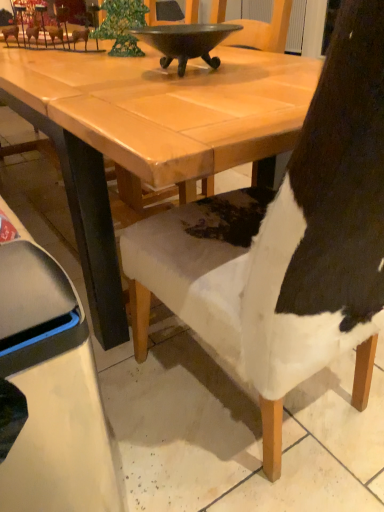
Identify the location of white fabric chair at lower right, acting as the 2th chair starting from the right. (52, 389).

Consider the image. How many degrees apart are the facing directions of white fabric chair at lower right, acting as the 2th chair starting from the right, and white fur chair at center, marked as the second chair in a left-to-right arrangement?

180 degrees separate the facing orientations of white fabric chair at lower right, acting as the 2th chair starting from the right, and white fur chair at center, marked as the second chair in a left-to-right arrangement.

Is white fabric chair at lower right, acting as the 2th chair starting from the right, turned away from white fur chair at center, arranged as the 1th chair when viewed from the right?

No, white fabric chair at lower right, acting as the 2th chair starting from the right,'s orientation is not away from white fur chair at center, arranged as the 1th chair when viewed from the right.

Is white fabric chair at lower right, acting as the 2th chair starting from the right, bigger or smaller than white fur chair at center, marked as the second chair in a left-to-right arrangement?

In the image, white fabric chair at lower right, acting as the 2th chair starting from the right, appears to be smaller than white fur chair at center, marked as the second chair in a left-to-right arrangement.

Does white fur chair at center, arranged as the 1th chair when viewed from the right, turn towards shiny dark metal bowl at upper center?

Yes, white fur chair at center, arranged as the 1th chair when viewed from the right, is facing shiny dark metal bowl at upper center.

In the scene shown: Can you confirm if white fur chair at center, marked as the second chair in a left-to-right arrangement, is shorter than shiny dark metal bowl at upper center?

No.

Is the depth of white fur chair at center, marked as the second chair in a left-to-right arrangement, greater than that of shiny dark metal bowl at upper center?

No, the depth of white fur chair at center, marked as the second chair in a left-to-right arrangement, is less than that of shiny dark metal bowl at upper center.

Which is correct: white fur chair at center, marked as the second chair in a left-to-right arrangement, is inside shiny dark metal bowl at upper center, or outside of it?

white fur chair at center, marked as the second chair in a left-to-right arrangement, is located beyond the bounds of shiny dark metal bowl at upper center.

Which of these two, shiny dark metal bowl at upper center or white fabric chair at lower right, acting as the 2th chair starting from the right, stands shorter?

Standing shorter between the two is shiny dark metal bowl at upper center.

Does shiny dark metal bowl at upper center have a greater width compared to white fabric chair at lower right, acting as the 2th chair starting from the right?

No, shiny dark metal bowl at upper center is not wider than white fabric chair at lower right, acting as the 2th chair starting from the right.

Is shiny dark metal bowl at upper center beside white fabric chair at lower right, acting as the 2th chair starting from the right?

No, shiny dark metal bowl at upper center is not touching white fabric chair at lower right, acting as the 2th chair starting from the right.

From the image's perspective, is shiny dark metal bowl at upper center above or below white fabric chair at lower right, acting as the 2th chair starting from the right?

shiny dark metal bowl at upper center is above white fabric chair at lower right, acting as the 2th chair starting from the right.

Is the surface of white fabric chair at lower right, acting as the 2th chair starting from the right, in direct contact with shiny dark metal bowl at upper center?

No, white fabric chair at lower right, acting as the 2th chair starting from the right, is not making contact with shiny dark metal bowl at upper center.

Which of these two, white fabric chair at lower right, the 1th chair when ordered from left to right, or shiny dark metal bowl at upper center, is wider?

white fabric chair at lower right, the 1th chair when ordered from left to right, is wider.

Looking at this image, how different are the orientations of white fabric chair at lower right, the 1th chair when ordered from left to right, and shiny dark metal bowl at upper center in degrees?

92.4 degrees separate the facing orientations of white fabric chair at lower right, the 1th chair when ordered from left to right, and shiny dark metal bowl at upper center.

Does white fur chair at center, marked as the second chair in a left-to-right arrangement, touch white fabric chair at lower right, acting as the 2th chair starting from the right?

No, white fur chair at center, marked as the second chair in a left-to-right arrangement, is not touching white fabric chair at lower right, acting as the 2th chair starting from the right.

This screenshot has width=384, height=512. What are the coordinates of `chair on the left of white fur chair at center, marked as the second chair in a left-to-right arrangement` in the screenshot? It's located at (52, 389).

In the scene shown: Considering the sizes of objects white fur chair at center, marked as the second chair in a left-to-right arrangement, and white fabric chair at lower right, acting as the 2th chair starting from the right, in the image provided, who is shorter, white fur chair at center, marked as the second chair in a left-to-right arrangement, or white fabric chair at lower right, acting as the 2th chair starting from the right,?

white fabric chair at lower right, acting as the 2th chair starting from the right, is shorter.

Between point (381, 54) and point (61, 280), which one is positioned behind?

The point (61, 280) is farther.

From a real-world perspective, who is located lower, shiny dark metal bowl at upper center or white fur chair at center, marked as the second chair in a left-to-right arrangement?

In real-world perspective, white fur chair at center, marked as the second chair in a left-to-right arrangement, is lower.

From the image's perspective, who appears lower, shiny dark metal bowl at upper center or white fur chair at center, marked as the second chair in a left-to-right arrangement?

white fur chair at center, marked as the second chair in a left-to-right arrangement, from the image's perspective.

Who is more distant, shiny dark metal bowl at upper center or white fur chair at center, arranged as the 1th chair when viewed from the right?

Positioned behind is shiny dark metal bowl at upper center.

You are a GUI agent. You are given a task and a screenshot of the screen. Output one action in this format:
    pyautogui.click(x=<x>, y=<y>)
    Task: Click on the bowl located behind the white fur chair at center, arranged as the 1th chair when viewed from the right
    
    Given the screenshot: What is the action you would take?
    pyautogui.click(x=185, y=41)

In order to click on chair below the white fur chair at center, marked as the second chair in a left-to-right arrangement (from a real-world perspective) in this screenshot , I will do `click(52, 389)`.

I want to click on bowl above the white fur chair at center, marked as the second chair in a left-to-right arrangement (from a real-world perspective), so click(x=185, y=41).

Based on the photo, from the image, which object appears to be nearer to shiny dark metal bowl at upper center, white fabric chair at lower right, acting as the 2th chair starting from the right, or white fur chair at center, arranged as the 1th chair when viewed from the right?

white fur chair at center, arranged as the 1th chair when viewed from the right, is positioned closer to the anchor shiny dark metal bowl at upper center.

Based on their spatial positions, is shiny dark metal bowl at upper center or white fur chair at center, marked as the second chair in a left-to-right arrangement, closer to white fabric chair at lower right, acting as the 2th chair starting from the right?

white fur chair at center, marked as the second chair in a left-to-right arrangement, is closer to white fabric chair at lower right, acting as the 2th chair starting from the right.

When comparing their distances from white fabric chair at lower right, acting as the 2th chair starting from the right, does white fur chair at center, arranged as the 1th chair when viewed from the right, or shiny dark metal bowl at upper center seem further?

Based on the image, shiny dark metal bowl at upper center appears to be further to white fabric chair at lower right, acting as the 2th chair starting from the right.

In the scene shown: When comparing their distances from white fur chair at center, marked as the second chair in a left-to-right arrangement, does white fabric chair at lower right, the 1th chair when ordered from left to right, or shiny dark metal bowl at upper center seem further?

Among the two, shiny dark metal bowl at upper center is located further to white fur chair at center, marked as the second chair in a left-to-right arrangement.

Considering their positions, is white fur chair at center, marked as the second chair in a left-to-right arrangement, positioned further to shiny dark metal bowl at upper center than white fabric chair at lower right, the 1th chair when ordered from left to right?

Based on the image, white fabric chair at lower right, the 1th chair when ordered from left to right, appears to be further to shiny dark metal bowl at upper center.

Considering their positions, is shiny dark metal bowl at upper center positioned closer to white fur chair at center, arranged as the 1th chair when viewed from the right, than white fabric chair at lower right, acting as the 2th chair starting from the right?

Based on the image, white fabric chair at lower right, acting as the 2th chair starting from the right, appears to be nearer to white fur chair at center, arranged as the 1th chair when viewed from the right.

Locate an element on the screen. The image size is (384, 512). chair between shiny dark metal bowl at upper center and white fabric chair at lower right, the 1th chair when ordered from left to right, in the up-down direction is located at coordinates (285, 244).